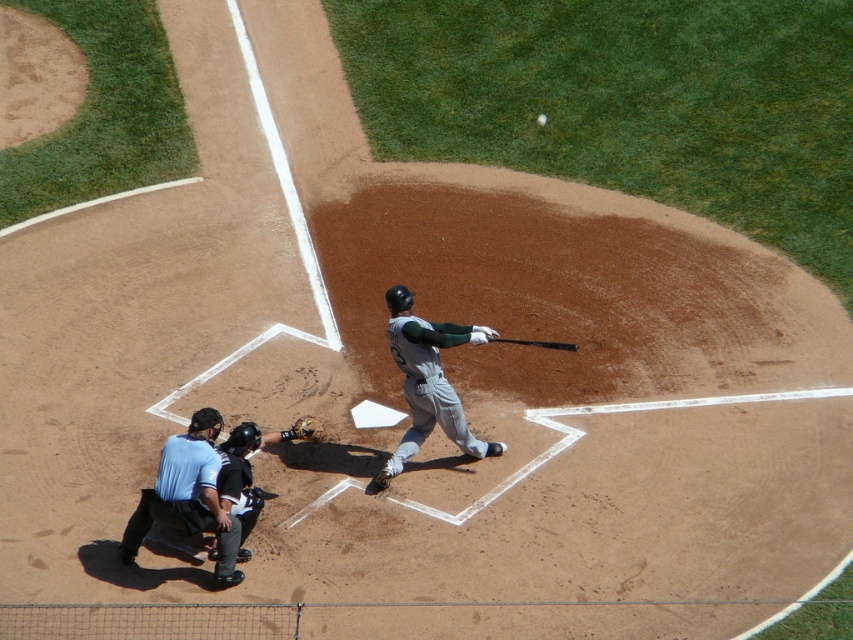
Question: Estimate the real-world distances between objects in this image. Which object is farther from the white matte baseball at center?

Choices:
 (A) blue shirt at lower left
 (B) brown leather glove at lower center

Answer: (A)

Question: Is blue shirt at lower left smaller than brown leather glove at lower center?

Choices:
 (A) yes
 (B) no

Answer: (B)

Question: Can you confirm if brown leather glove at lower center is positioned to the right of white matte baseball at center?

Choices:
 (A) no
 (B) yes

Answer: (A)

Question: Estimate the real-world distances between objects in this image. Which object is closer to the blue shirt at lower left?

Choices:
 (A) wooden baseball bat at center
 (B) gray matte uniform at center
 (C) black leather glove at lower center
 (D) white matte baseball at center

Answer: (C)

Question: Which is nearer to the brown leather glove at lower center?

Choices:
 (A) blue shirt at lower left
 (B) gray matte uniform at center
 (C) wooden baseball bat at center

Answer: (B)

Question: Can you confirm if blue shirt at lower left is positioned to the right of white matte baseball at center?

Choices:
 (A) no
 (B) yes

Answer: (A)